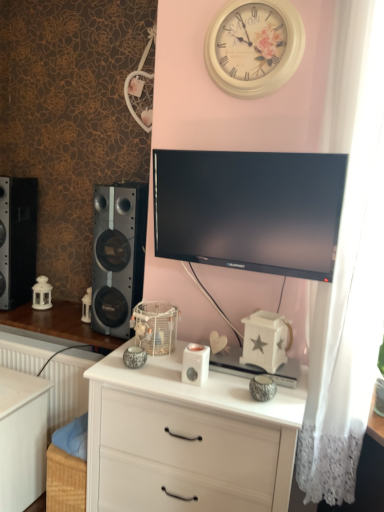
Locate an element on the screen. The height and width of the screenshot is (512, 384). unoccupied area in front of white plastic ipod at center is located at coordinates (198, 390).